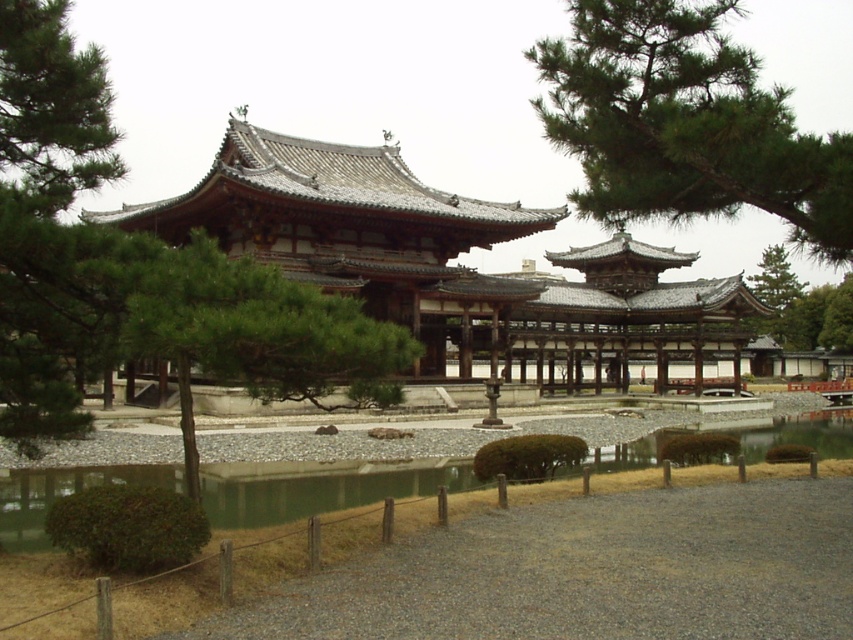
Is shiny gray roof at center closer to the viewer compared to green textured tree at center?

No.

Can you confirm if shiny gray roof at center is bigger than green textured tree at center?

Yes.

Where is `shiny gray roof at center`? shiny gray roof at center is located at coordinates (445, 262).

The width and height of the screenshot is (853, 640). What are the coordinates of `shiny gray roof at center` in the screenshot? It's located at (445, 262).

Does point (9, 8) come in front of point (32, 474)?

Yes, it is in front of point (32, 474).

Who is taller, green leafy tree at left or green water at center?

Standing taller between the two is green water at center.

Who is more forward, (93, 323) or (418, 477)?

Positioned in front is point (93, 323).

You are a GUI agent. You are given a task and a screenshot of the screen. Output one action in this format:
    pyautogui.click(x=<x>, y=<y>)
    Task: Click on the green leafy tree at left
    Image resolution: width=853 pixels, height=640 pixels.
    Given the screenshot: What is the action you would take?
    pyautogui.click(x=134, y=266)

The height and width of the screenshot is (640, 853). What are the coordinates of `shiny gray roof at center` in the screenshot? It's located at (445, 262).

Is the position of shiny gray roof at center more distant than that of green needle-like leaves at upper right?

That is True.

At what (x,y) coordinates should I click in order to perform the action: click on shiny gray roof at center. Please return your answer as a coordinate pair (x, y). This screenshot has height=640, width=853. Looking at the image, I should click on (445, 262).